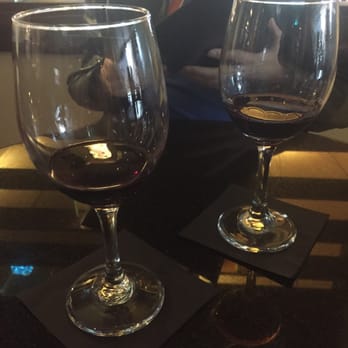
Identify the location of stem of left wineglass. (115, 244).